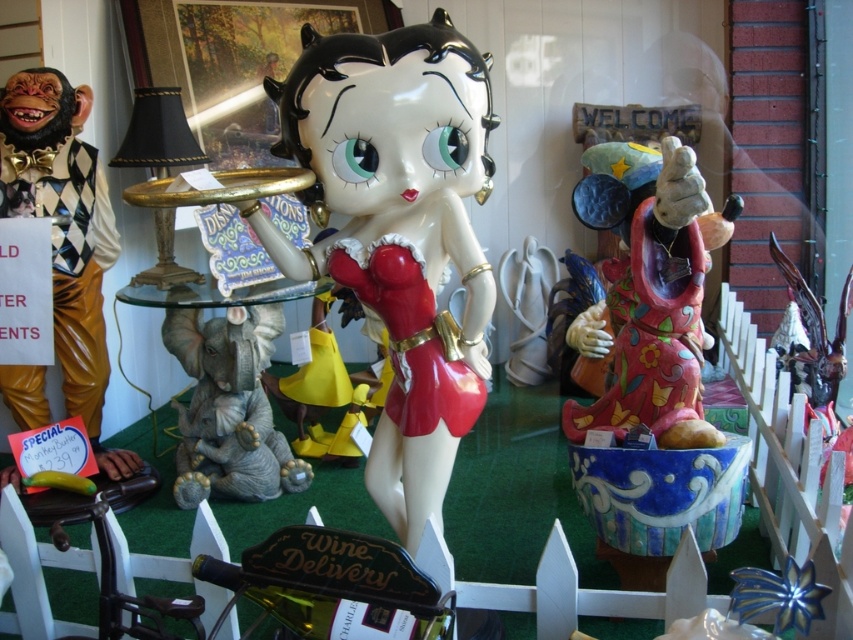
Question: Which of the following is the closest to the observer?

Choices:
 (A) (201, 358)
 (B) (624, 308)

Answer: (B)

Question: Which point is closer to the camera?

Choices:
 (A) (582, 193)
 (B) (234, 417)
 (C) (16, 371)
 (D) (370, 173)

Answer: (D)

Question: Does matte ceramic statue at right lie behind wooden monkey at left?

Choices:
 (A) no
 (B) yes

Answer: (A)

Question: Does matte ceramic statue at right appear on the left side of wooden monkey at left?

Choices:
 (A) no
 (B) yes

Answer: (A)

Question: Among these objects, which one is nearest to the camera?

Choices:
 (A) glossy ceramic betty boop at center
 (B) wooden monkey at left
 (C) matte ceramic statue at right

Answer: (A)

Question: Can you confirm if wooden monkey at left is positioned above satin gray elephant at lower left?

Choices:
 (A) no
 (B) yes

Answer: (B)